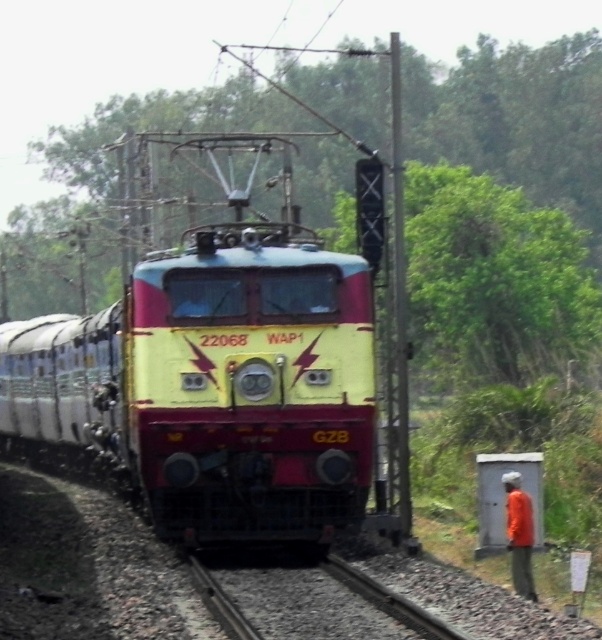
Question: Which object is positioned farthest from the orange fabric shirt at lower right?

Choices:
 (A) green leafy tree at upper center
 (B) black gravel train track at center

Answer: (A)

Question: Does green leafy tree at upper center come behind black gravel train track at center?

Choices:
 (A) yes
 (B) no

Answer: (A)

Question: Is green leafy tree at upper center to the left of black gravel train track at center from the viewer's perspective?

Choices:
 (A) no
 (B) yes

Answer: (A)

Question: Which object is closer to the camera taking this photo?

Choices:
 (A) yellow matte train at center
 (B) orange fabric shirt at lower right
 (C) green leafy tree at upper center

Answer: (B)

Question: Among these objects, which one is farthest from the camera?

Choices:
 (A) orange fabric shirt at lower right
 (B) yellow matte train at center
 (C) green leafy tree at upper center

Answer: (C)

Question: Is black gravel train track at center positioned before orange fabric shirt at lower right?

Choices:
 (A) yes
 (B) no

Answer: (A)